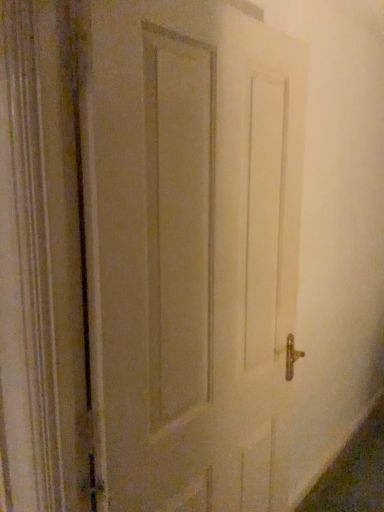
What are the coordinates of `white matte door at center` in the screenshot? It's located at (190, 251).

What do you see at coordinates (190, 251) in the screenshot? I see `white matte door at center` at bounding box center [190, 251].

What is the approximate height of white matte door at center?

white matte door at center is 5.78 feet in height.

This screenshot has height=512, width=384. Find the location of `white matte door at center`. white matte door at center is located at coordinates (190, 251).